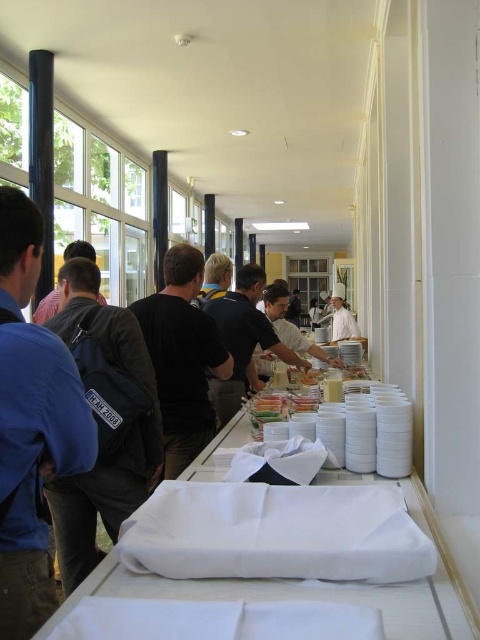
Question: Is blue shirt at left to the right of black matte shirt at center from the viewer's perspective?

Choices:
 (A) no
 (B) yes

Answer: (A)

Question: Which point appears closest to the camera in this image?

Choices:
 (A) (16, 353)
 (B) (180, 460)
 (C) (343, 294)
 (D) (445, 600)

Answer: (D)

Question: Can you confirm if white cloth at center is positioned below black matte shirt at center?

Choices:
 (A) yes
 (B) no

Answer: (A)

Question: Does white cloth at center appear over black matte shirt at center?

Choices:
 (A) no
 (B) yes

Answer: (A)

Question: Estimate the real-world distances between objects in this image. Which object is farther from the white cloth at center?

Choices:
 (A) white fabric at center
 (B) blue shirt at left

Answer: (A)

Question: Based on their relative distances, which object is nearer to the black matte shirt at center?

Choices:
 (A) white fabric at center
 (B) white cloth at center
 (C) blue shirt at left

Answer: (B)